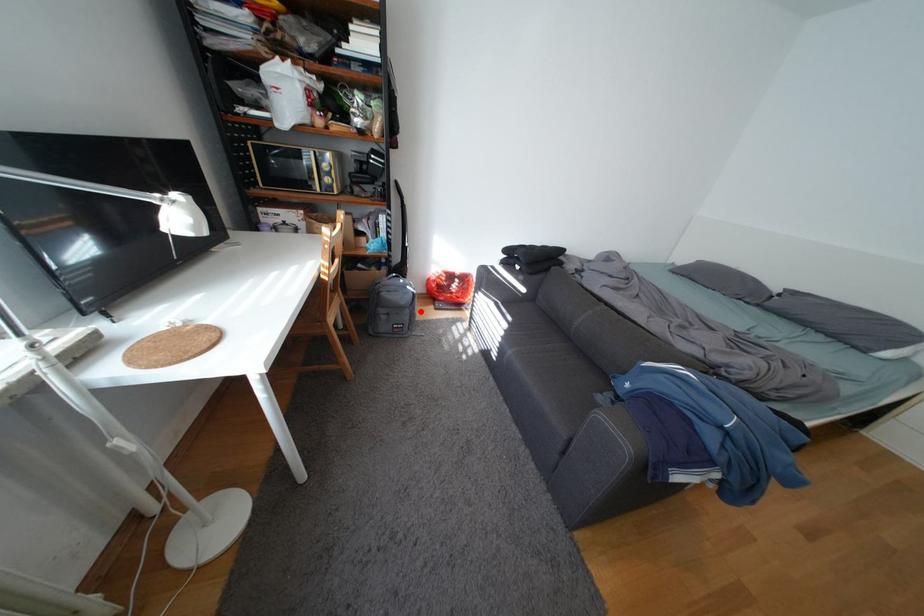
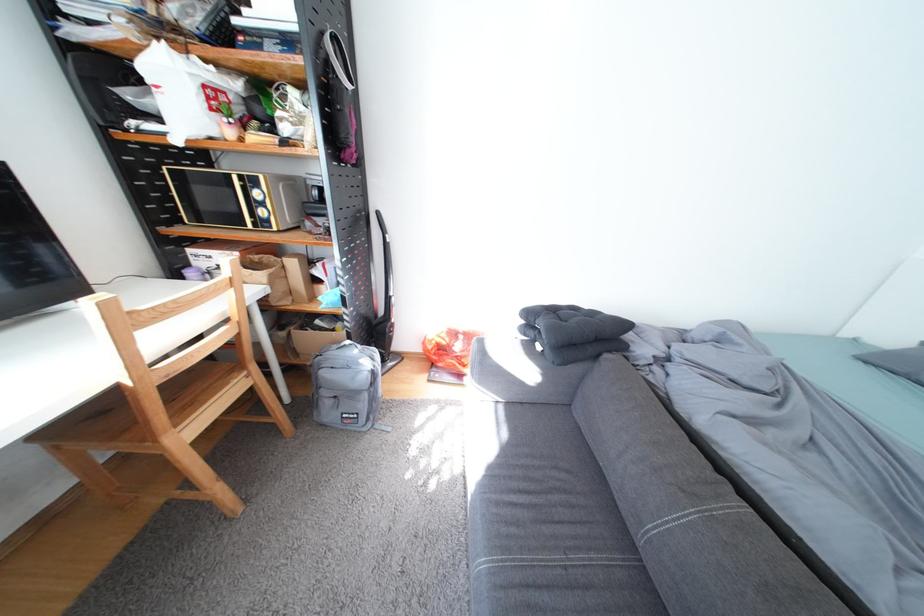
Question: I am providing you with two images of the same scene from different viewpoints. A red point is marked on the first image. Can you still see the location of the red point in image 2?

Choices:
 (A) Yes
 (B) No

Answer: (A)